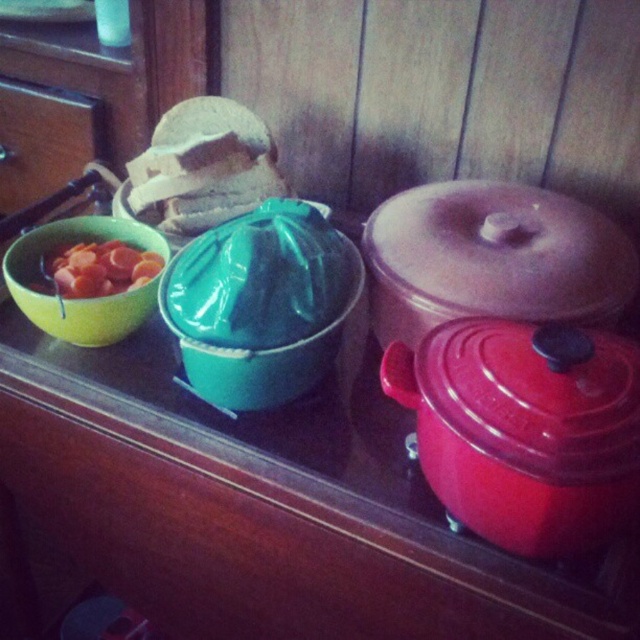
Who is higher up, matte green juicer at center or smooth orange slices at left?

smooth orange slices at left is above.

Is matte green juicer at center in front of smooth orange slices at left?

Yes, matte green juicer at center is closer to the viewer.

This screenshot has width=640, height=640. Identify the location of matte green juicer at center. (273, 349).

Which of these two, bread-like object at upper left or matte green juicer at center, stands taller?

bread-like object at upper left

In the scene shown: Measure the distance between bread-like object at upper left and camera.

bread-like object at upper left is 34.30 inches from camera.

Where is `bread-like object at upper left`? bread-like object at upper left is located at coordinates (202, 168).

Which is more to the left, bread-like object at upper left or smooth orange slices at left?

smooth orange slices at left

The height and width of the screenshot is (640, 640). In order to click on bread-like object at upper left in this screenshot , I will do `click(202, 168)`.

Where is `bread-like object at upper left`? Image resolution: width=640 pixels, height=640 pixels. bread-like object at upper left is located at coordinates (202, 168).

I want to click on bread-like object at upper left, so click(202, 168).